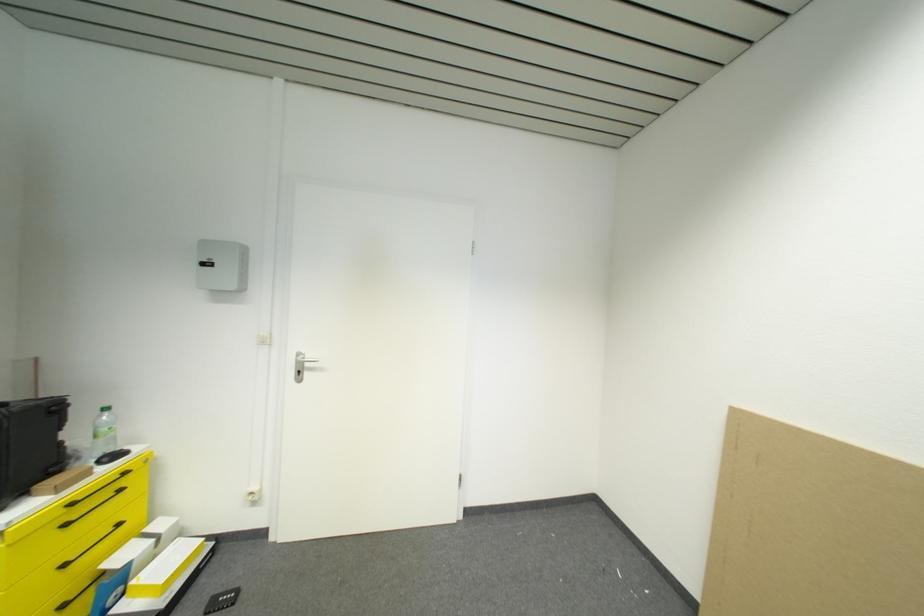
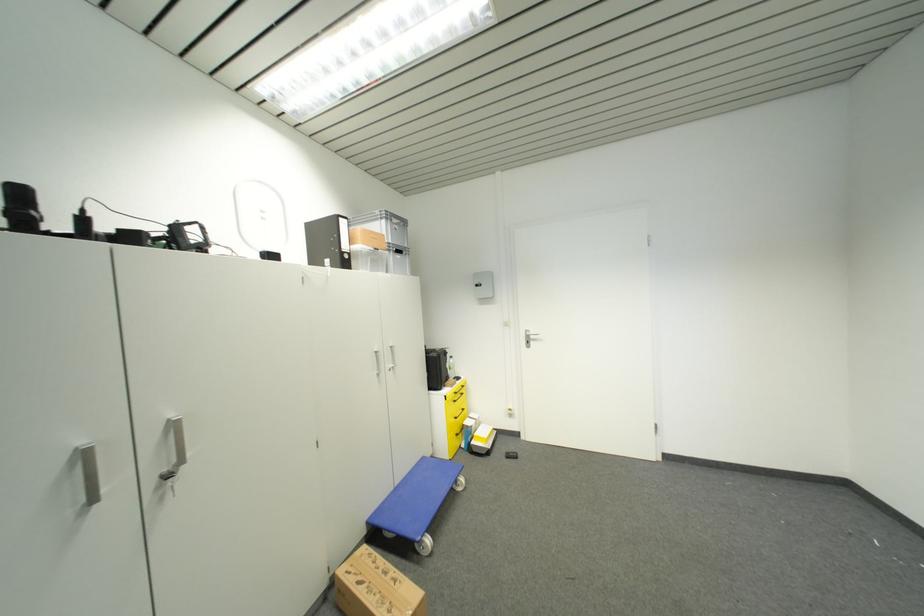
Question: The camera is either moving clockwise (left) or counter-clockwise (right) around the object. The first image is from the beginning of the video and the second image is from the end. Is the camera moving left or right when shooting the video?

Choices:
 (A) Left
 (B) Right

Answer: (B)